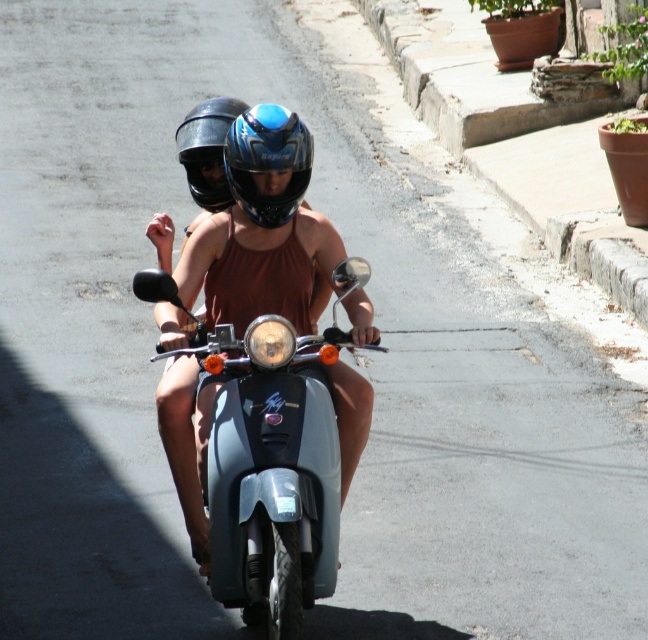
You are a pedestrian standing on the sidewalk watching the scooter riders. Which helmet is closer to you between the blue glossy helmet at center and the shiny black helmet at center?

The blue glossy helmet at center is closer to you because it is positioned in front of the shiny black helmet at center.

You are standing at the origin point of the coordinate system where the street is the x axis. There is a metallic blue scooter at center represented by point [273,461]. Where is the metallic blue scooter at center located relative to your position?

The metallic blue scooter at center is located at coordinates [273,461], which means it is positioned to the right and slightly above your current position at the origin.

You are standing on the sidewalk and see the scooter with two people. You notice two points marked on the scooter. Which point is closer to you, point at coordinate (273, 349) or point at coordinate (205, 152)?

Point at coordinate (273, 349) is closer to you than point at coordinate (205, 152).